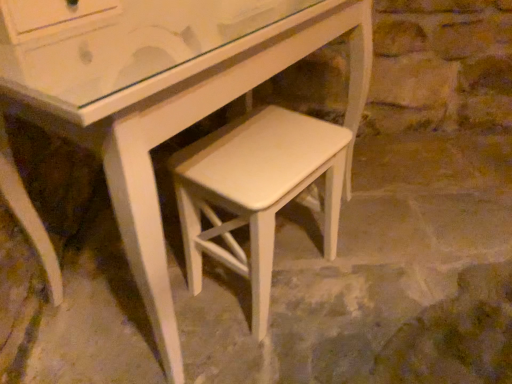
The image size is (512, 384). I want to click on empty space that is to the right of white matte stool at center, so (x=369, y=273).